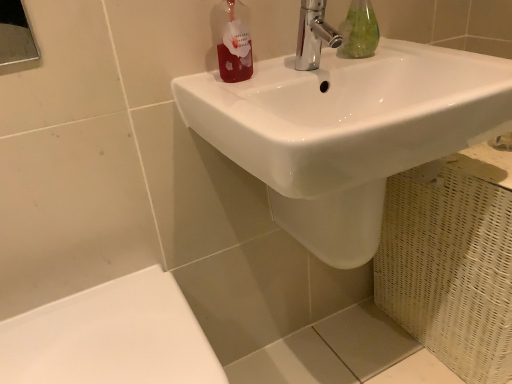
Where is `free space between chrome/metallic faucet at upper center and translucent red bottle at upper center`? free space between chrome/metallic faucet at upper center and translucent red bottle at upper center is located at coordinates (275, 76).